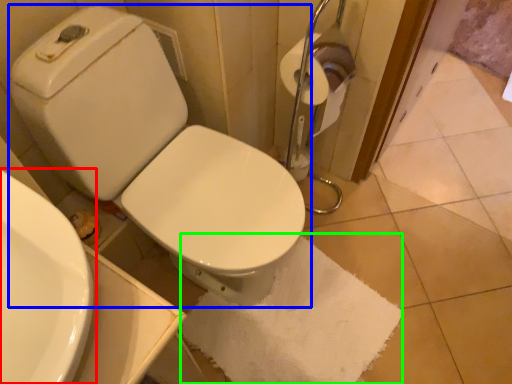
Question: Which is nearer to the sink (highlighted by a red box)? toilet (highlighted by a blue box) or bath towel (highlighted by a green box).

Choices:
 (A) toilet
 (B) bath towel

Answer: (A)